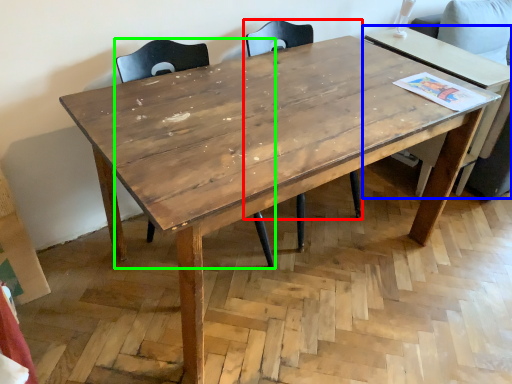
Question: Based on their relative distances, which object is farther from chair (highlighted by a red box)? Choose from table (highlighted by a blue box) and chair (highlighted by a green box).

Choices:
 (A) table
 (B) chair

Answer: (A)